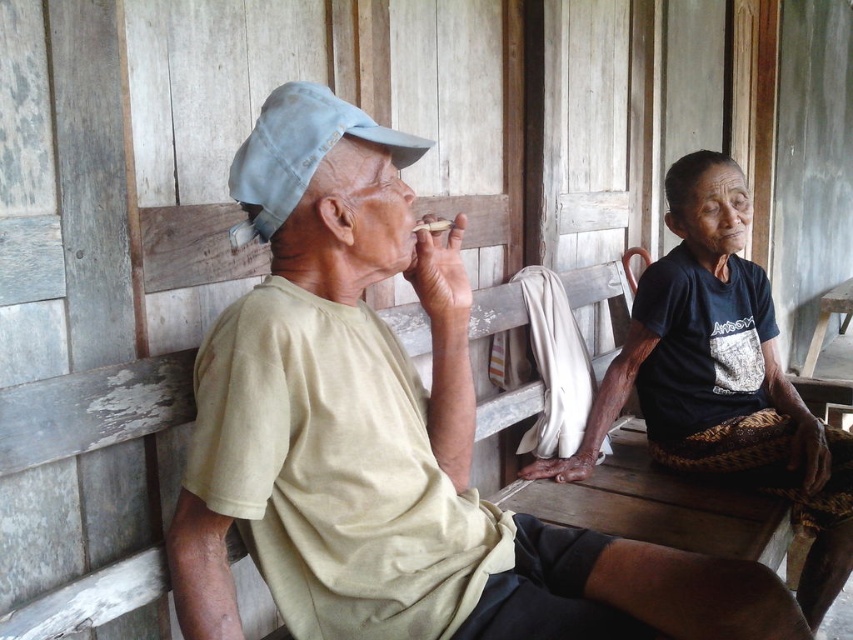
You are a photographer trying to capture a group photo of the beige cotton shirt at left and the dark blue fabric shirt at center. Which of the two shirts should you adjust to ensure both are visible in the frame, considering their height difference?

The beige cotton shirt at left has a lesser height compared to dark blue fabric shirt at center. To ensure both are visible, you should adjust the beige cotton shirt at left to be positioned higher in the frame so it aligns with the height of the dark blue fabric shirt at center.

You are standing in front of the rustic structure and want to locate the beige cotton shirt at left. Where exactly is it positioned relative to the structure?

The beige cotton shirt at left is positioned at point 0.683 on the x axis and 0.457 on the y axis relative to the structure.

You are a photographer standing 5 feet away from the beige cotton shirt at left and dark blue fabric shirt at center. You want to take a photo of both shirts in the same frame. Will the distance between them allow you to capture both shirts in a single photo without moving the camera?

The distance between beige cotton shirt at left and dark blue fabric shirt at center is 37.76 inches. Since you are standing 5 feet away, which is 60 inches, the camera can easily capture both shirts in the same frame as the distance between them is less than your distance from them.